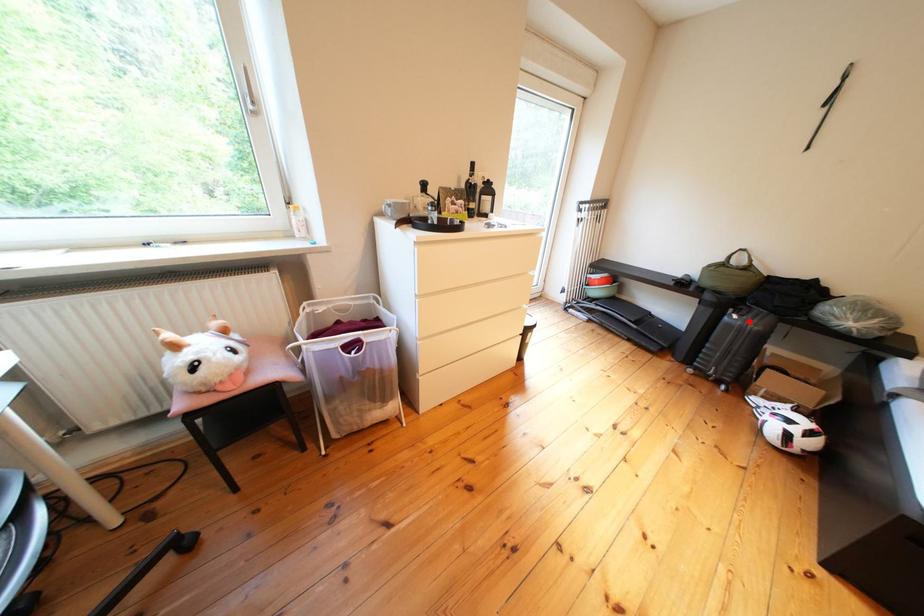
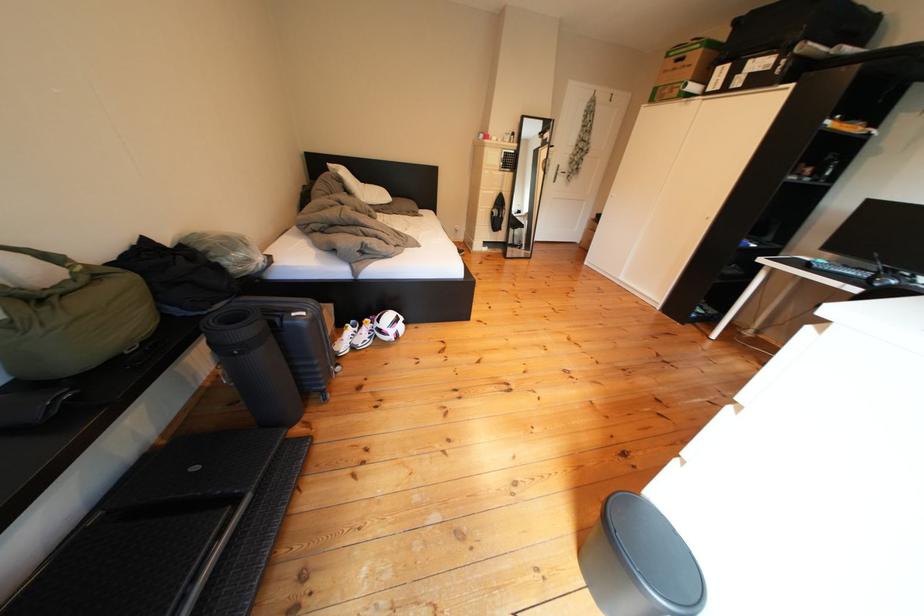
Locate, in the second image, the point that corresponds to the highlighted location in the first image.

(317, 318)